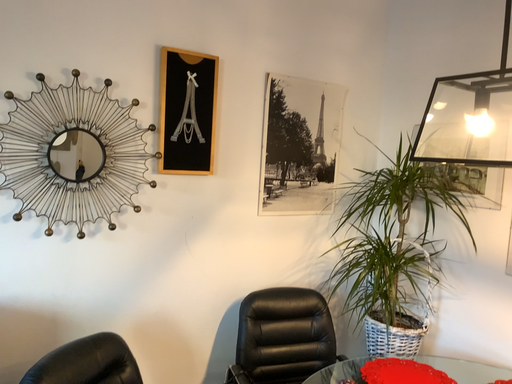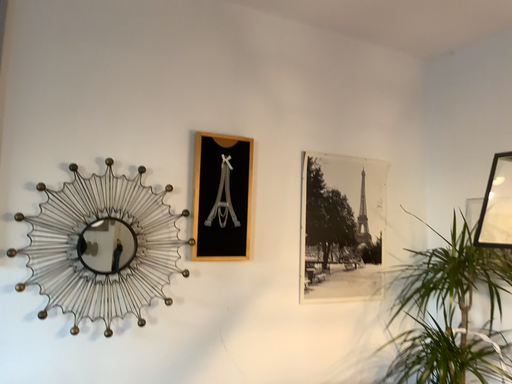
Question: Which way did the camera rotate in the video?

Choices:
 (A) rotated upward
 (B) rotated downward

Answer: (A)